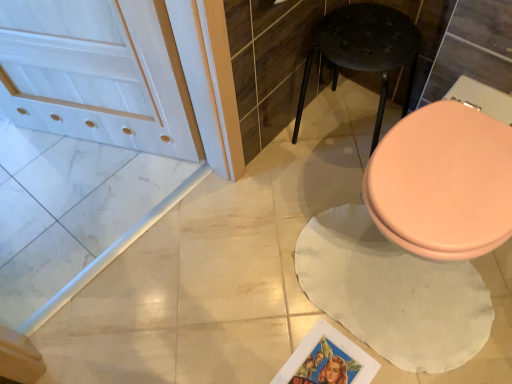
What do you see at coordinates (364, 49) in the screenshot?
I see `black matte stool at center` at bounding box center [364, 49].

Where is `black matte stool at center`? black matte stool at center is located at coordinates (364, 49).

The image size is (512, 384). What are the coordinates of `black matte stool at center` in the screenshot? It's located at (364, 49).